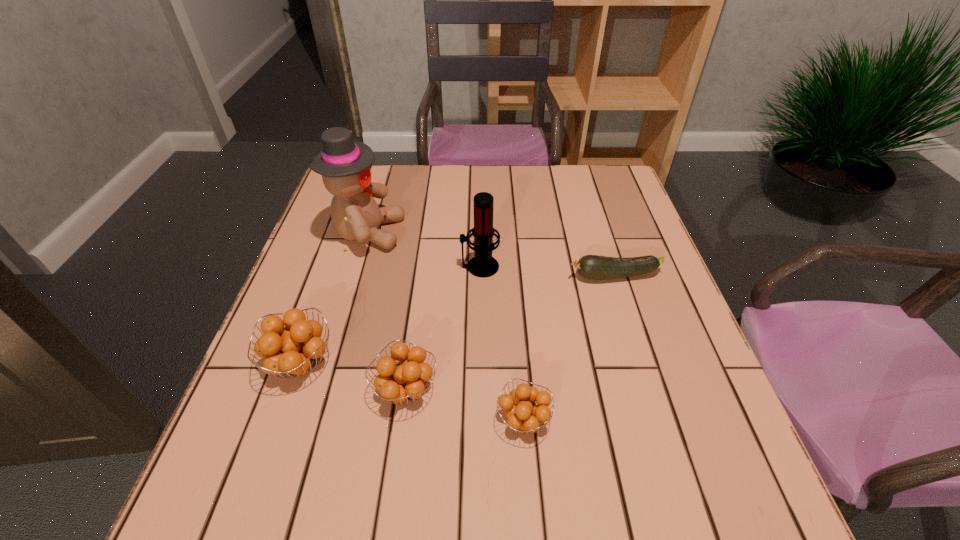
All orange fruits are currently evenly spaced. To continue this pattern, where would you add another orange fruit on the right? Please point out a vacant spot. Please provide its 2D coordinates. Your answer should be formatted as a tuple, i.e. [(x, y)], where the tuple contains the x and y coordinates of a point satisfying the conditions above.

[(655, 453)]